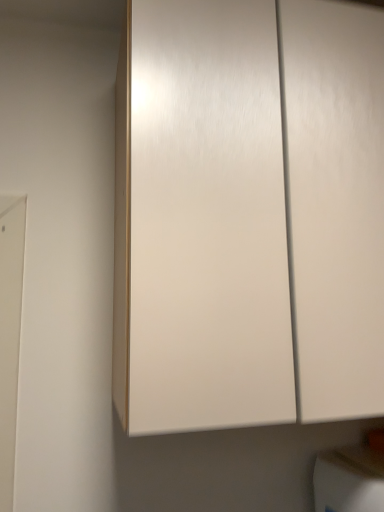
Find the location of a particular element. The width and height of the screenshot is (384, 512). white glossy cupboard at center is located at coordinates (248, 214).

Describe the element at coordinates (248, 214) in the screenshot. I see `white glossy cupboard at center` at that location.

In order to face white glossy cupboard at center, should I rotate leftwards or rightwards?

Rotate right and turn 7.429 degrees.

Identify the location of white glossy cupboard at center. (248, 214).